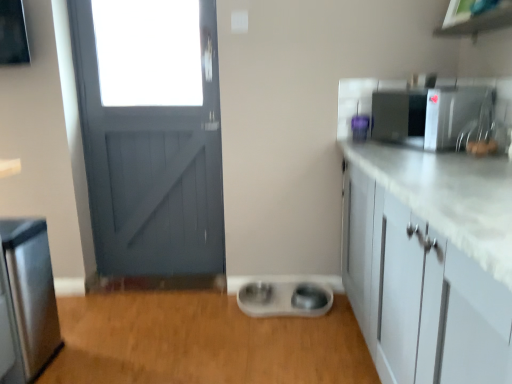
Question: Considering the relative sizes of purple plastic container at upper right, the 2th appliance positioned from the right, and satin silver microwave at upper right, acting as the 1th appliance starting from the right, in the image provided, is purple plastic container at upper right, the 2th appliance positioned from the right, taller than satin silver microwave at upper right, acting as the 1th appliance starting from the right,?

Choices:
 (A) yes
 (B) no

Answer: (B)

Question: From a real-world perspective, is purple plastic container at upper right, the 2th appliance positioned from the right, physically below satin silver microwave at upper right, the 3th appliance positioned from the bottom?

Choices:
 (A) yes
 (B) no

Answer: (A)

Question: Does purple plastic container at upper right, the 2th appliance positioned from the top, have a greater width compared to satin silver microwave at upper right, marked as the third appliance in a left-to-right arrangement?

Choices:
 (A) no
 (B) yes

Answer: (A)

Question: Is purple plastic container at upper right, which is the 2th appliance from left to right, closer to camera compared to satin silver microwave at upper right, the 3th appliance positioned from the bottom?

Choices:
 (A) yes
 (B) no

Answer: (B)

Question: From the image's perspective, would you say purple plastic container at upper right, the 2th appliance positioned from the top, is shown under satin silver microwave at upper right, marked as the third appliance in a left-to-right arrangement?

Choices:
 (A) no
 (B) yes

Answer: (B)

Question: Considering the relative sizes of purple plastic container at upper right, the 2th appliance positioned from the right, and satin silver microwave at upper right, marked as the third appliance in a left-to-right arrangement, in the image provided, is purple plastic container at upper right, the 2th appliance positioned from the right, shorter than satin silver microwave at upper right, marked as the third appliance in a left-to-right arrangement,?

Choices:
 (A) no
 (B) yes

Answer: (B)

Question: Does satin silver microwave at upper right, acting as the 1th appliance starting from the right, appear on the left side of white plastic pet bowls at center?

Choices:
 (A) yes
 (B) no

Answer: (B)

Question: Is satin silver microwave at upper right, marked as the third appliance in a left-to-right arrangement, closer to camera compared to white plastic pet bowls at center?

Choices:
 (A) no
 (B) yes

Answer: (B)

Question: Does satin silver microwave at upper right, which appears as the first appliance when viewed from the top, appear on the right side of white plastic pet bowls at center?

Choices:
 (A) yes
 (B) no

Answer: (A)

Question: Considering the relative sizes of satin silver microwave at upper right, marked as the third appliance in a left-to-right arrangement, and white plastic pet bowls at center in the image provided, is satin silver microwave at upper right, marked as the third appliance in a left-to-right arrangement, wider than white plastic pet bowls at center?

Choices:
 (A) yes
 (B) no

Answer: (B)

Question: From a real-world perspective, is satin silver microwave at upper right, acting as the 1th appliance starting from the right, positioned over white plastic pet bowls at center based on gravity?

Choices:
 (A) no
 (B) yes

Answer: (B)

Question: Is satin silver microwave at upper right, the 3th appliance positioned from the bottom, taller than white plastic pet bowls at center?

Choices:
 (A) no
 (B) yes

Answer: (B)

Question: Is satin nickel faucet at upper right beside white plastic pet bowls at center?

Choices:
 (A) no
 (B) yes

Answer: (A)